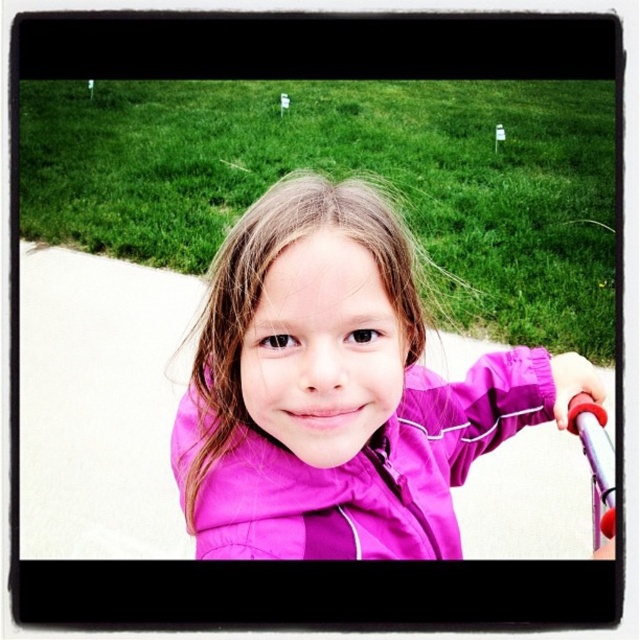
Question: Is purple matte jacket at center positioned before matte purple jacket at center?

Choices:
 (A) yes
 (B) no

Answer: (A)

Question: Is purple matte jacket at center wider than matte purple jacket at center?

Choices:
 (A) yes
 (B) no

Answer: (A)

Question: Which point appears closest to the camera in this image?

Choices:
 (A) (419, 369)
 (B) (189, 476)

Answer: (B)

Question: Which point is closer to the camera taking this photo?

Choices:
 (A) (x=513, y=369)
 (B) (x=262, y=476)

Answer: (B)

Question: Does purple matte jacket at center have a greater width compared to matte purple jacket at center?

Choices:
 (A) yes
 (B) no

Answer: (A)

Question: Which point is farther to the camera?

Choices:
 (A) matte purple jacket at center
 (B) purple matte jacket at center

Answer: (A)